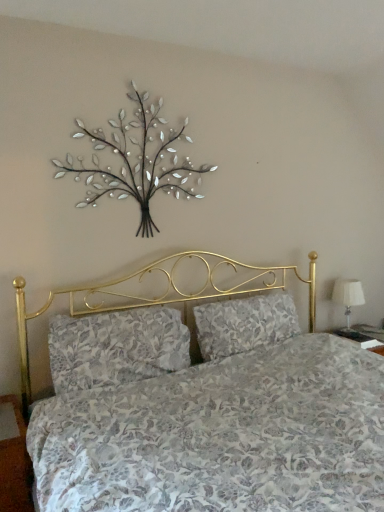
Question: Is floral fabric pillow at center, which is the first pillow in left-to-right order, wider than metallic silver tree at upper center?

Choices:
 (A) yes
 (B) no

Answer: (A)

Question: From a real-world perspective, is floral fabric pillow at center, which is the first pillow in left-to-right order, physically below metallic silver tree at upper center?

Choices:
 (A) yes
 (B) no

Answer: (A)

Question: Is the depth of floral fabric pillow at center, positioned as the 2th pillow in right-to-left order, greater than that of metallic silver tree at upper center?

Choices:
 (A) no
 (B) yes

Answer: (A)

Question: Would you say floral fabric pillow at center, which is the first pillow in left-to-right order, is outside metallic silver tree at upper center?

Choices:
 (A) no
 (B) yes

Answer: (B)

Question: Is floral fabric pillow at center, positioned as the 2th pillow in right-to-left order, positioned with its back to metallic silver tree at upper center?

Choices:
 (A) no
 (B) yes

Answer: (A)

Question: Would you say metallic silver tree at upper center is part of floral fabric pillow at center, positioned as the 2th pillow in right-to-left order,'s contents?

Choices:
 (A) no
 (B) yes

Answer: (A)

Question: Is floral fabric pillow at center, which is the first pillow from right to left, thinner than floral fabric pillow at center, which is the first pillow in left-to-right order?

Choices:
 (A) no
 (B) yes

Answer: (B)

Question: From a real-world perspective, is floral fabric pillow at center, the second pillow from the left, positioned under floral fabric pillow at center, positioned as the 2th pillow in right-to-left order, based on gravity?

Choices:
 (A) no
 (B) yes

Answer: (B)

Question: Considering the relative positions of floral fabric pillow at center, the second pillow from the left, and floral fabric pillow at center, which is the first pillow in left-to-right order, in the image provided, is floral fabric pillow at center, the second pillow from the left, to the left of floral fabric pillow at center, which is the first pillow in left-to-right order, from the viewer's perspective?

Choices:
 (A) no
 (B) yes

Answer: (A)

Question: Is floral fabric pillow at center, which is the first pillow from right to left, positioned with its back to floral fabric pillow at center, which is the first pillow in left-to-right order?

Choices:
 (A) no
 (B) yes

Answer: (A)

Question: Considering the relative sizes of floral fabric pillow at center, the second pillow from the left, and floral fabric pillow at center, which is the first pillow in left-to-right order, in the image provided, is floral fabric pillow at center, the second pillow from the left, bigger than floral fabric pillow at center, which is the first pillow in left-to-right order,?

Choices:
 (A) yes
 (B) no

Answer: (B)

Question: From the image's perspective, does floral fabric pillow at center, the second pillow from the left, appear lower than floral fabric pillow at center, which is the first pillow in left-to-right order?

Choices:
 (A) no
 (B) yes

Answer: (A)

Question: Can you confirm if white fabric lampshade at right is smaller than floral fabric pillow at center, the second pillow from the left?

Choices:
 (A) no
 (B) yes

Answer: (B)